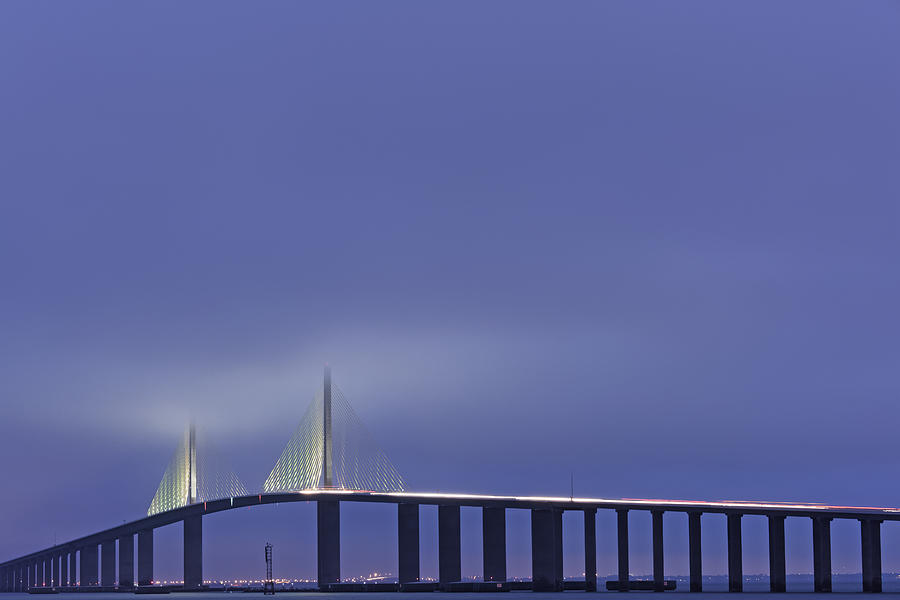
The height and width of the screenshot is (600, 900). What are the coordinates of `triangular lights` in the screenshot? It's located at (185, 467), (330, 446).